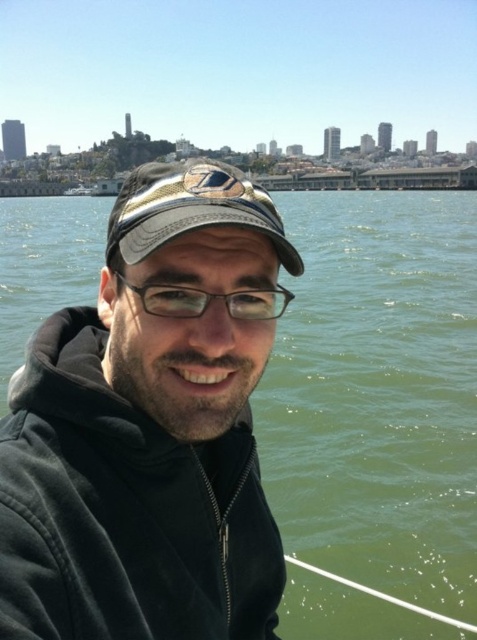
Which of these two, green water at center or metallic gold cap at center, stands taller?

Standing taller between the two is green water at center.

Between green water at center and metallic gold cap at center, which one has less height?

metallic gold cap at center

Which is behind, point (426, 212) or point (133, 220)?

The point (426, 212) is behind.

Locate an element on the screen. This screenshot has height=640, width=477. green water at center is located at coordinates (377, 394).

Does green water at center appear under transparent plastic glasses at center?

No.

Is green water at center positioned at the back of transparent plastic glasses at center?

Yes, it is behind transparent plastic glasses at center.

Where is `green water at center`? green water at center is located at coordinates (377, 394).

Image resolution: width=477 pixels, height=640 pixels. I want to click on green water at center, so point(377,394).

Is metallic gold cap at center closer to the viewer compared to transparent plastic glasses at center?

Yes, metallic gold cap at center is in front of transparent plastic glasses at center.

Who is more forward, (266, 234) or (134, 289)?

Point (266, 234) is in front.

Between point (227, 198) and point (190, 292), which one is positioned behind?

Positioned behind is point (190, 292).

You are a GUI agent. You are given a task and a screenshot of the screen. Output one action in this format:
    pyautogui.click(x=<x>, y=<y>)
    Task: Click on the metallic gold cap at center
    The height and width of the screenshot is (640, 477).
    Given the screenshot: What is the action you would take?
    pyautogui.click(x=189, y=209)